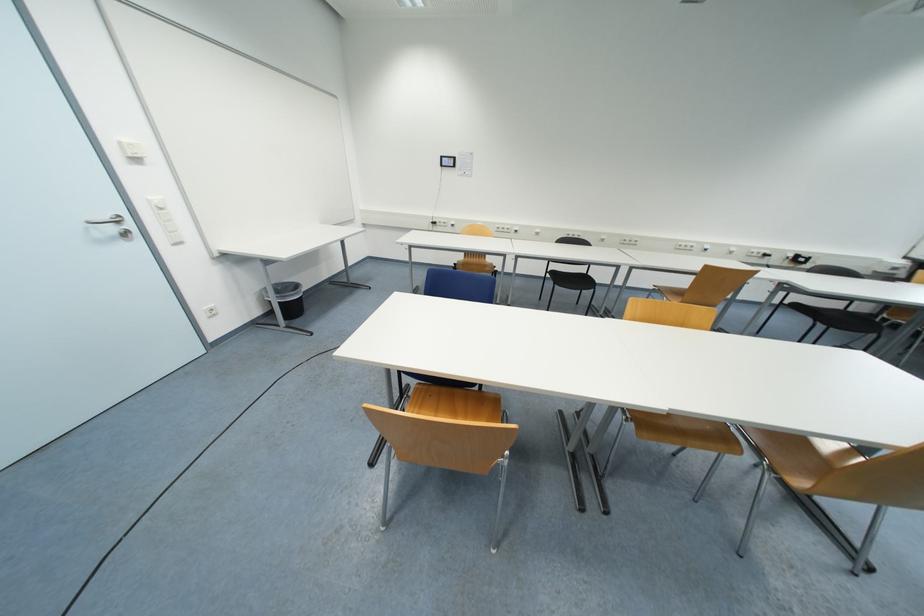
The width and height of the screenshot is (924, 616). Describe the element at coordinates (114, 225) in the screenshot. I see `the silver door handle` at that location.